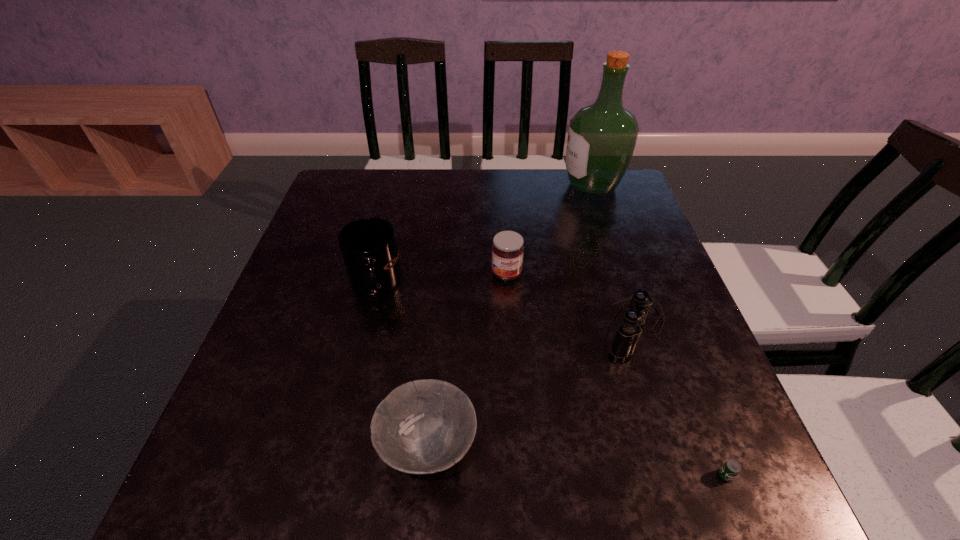
The height and width of the screenshot is (540, 960). I want to click on vacant point located between the fifth tallest object and the shortest object, so click(x=577, y=461).

Image resolution: width=960 pixels, height=540 pixels. I want to click on vacant area between the binoculars and the beer can, so click(x=680, y=401).

This screenshot has height=540, width=960. What are the coordinates of `vacant area between the farthest object and the beer can` in the screenshot? It's located at (659, 330).

This screenshot has width=960, height=540. I want to click on free space between the shortest object and the fifth object from right to left, so (x=577, y=461).

Find the location of a particular element. Image resolution: width=960 pixels, height=540 pixels. free space between the third object from left to right and the second object from left to right is located at coordinates (468, 360).

You are a GUI agent. You are given a task and a screenshot of the screen. Output one action in this format:
    pyautogui.click(x=<x>, y=<y>)
    Task: Click on the unoccupied area between the tallest object and the beer can
    The height and width of the screenshot is (540, 960).
    Given the screenshot: What is the action you would take?
    pyautogui.click(x=659, y=330)

Find the location of a particular element. Image resolution: width=960 pixels, height=540 pixels. vacant area between the liquor and the beer can is located at coordinates (659, 330).

At what (x,y) coordinates should I click in order to perform the action: click on free space between the binoculars and the second object from left to right. Please return your answer as a coordinate pair (x, y). The image size is (960, 540). Looking at the image, I should click on (531, 386).

Identify the location of free space between the binoculars and the fourth object from right to left. The image size is (960, 540). (570, 300).

Find the location of a particular element. Image resolution: width=960 pixels, height=540 pixels. the second closest object relative to the jam is located at coordinates (368, 246).